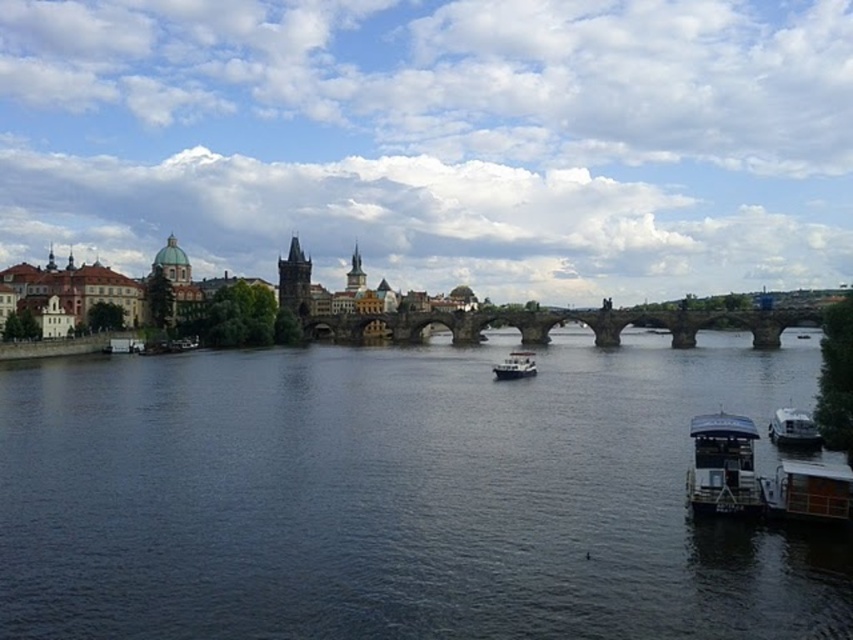
Question: Which object is the closest to the dark blue water at center?

Choices:
 (A) white glossy boat at center
 (B) white plastic boat at lower right
 (C) white glossy boat at lower right

Answer: (B)

Question: Does metallic gray boat at lower right have a lesser width compared to white glossy boat at center?

Choices:
 (A) no
 (B) yes

Answer: (A)

Question: Can you confirm if metallic gray boat at lower right is positioned to the left of white glossy boat at lower right?

Choices:
 (A) yes
 (B) no

Answer: (A)

Question: Which of the following is the farthest from the observer?

Choices:
 (A) (55, 381)
 (B) (502, 368)
 (C) (776, 435)
 (D) (734, 500)

Answer: (B)

Question: Which point is closer to the camera?

Choices:
 (A) pyautogui.click(x=781, y=470)
 (B) pyautogui.click(x=601, y=364)

Answer: (A)

Question: Can you confirm if white glossy boat at lower right is smaller than white glossy boat at center?

Choices:
 (A) no
 (B) yes

Answer: (B)